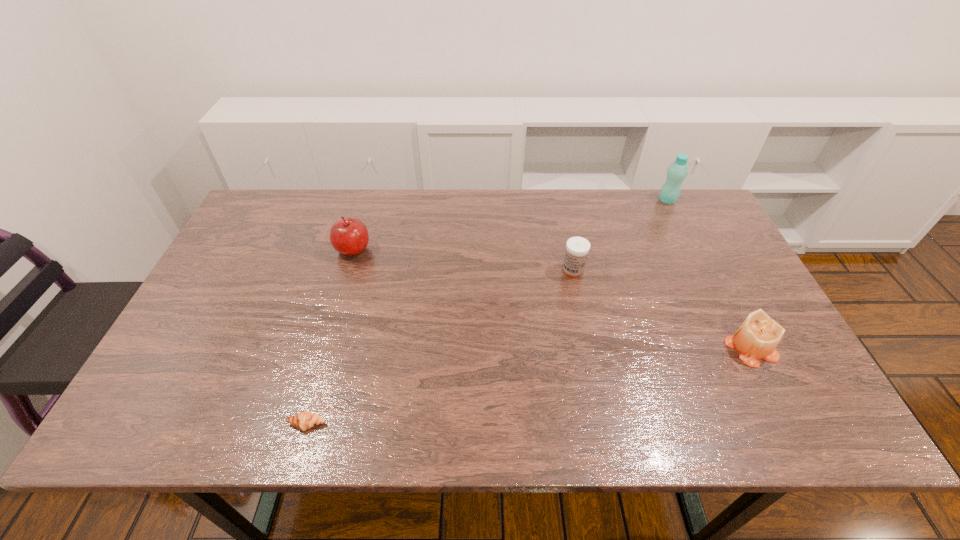
Locate an element on the screen. vacant area at the far left corner is located at coordinates (264, 191).

Find the location of a particular element. The height and width of the screenshot is (540, 960). vacant point at the far right corner is located at coordinates (695, 222).

The image size is (960, 540). Find the location of `free point between the shortest object and the farthest object`. free point between the shortest object and the farthest object is located at coordinates (487, 312).

Identify the location of empty location between the second nearest object and the nearest object. point(529,387).

What are the coordinates of `free spot between the medicine and the apple` in the screenshot? It's located at (463, 260).

Locate an element on the screen. empty location between the third object from right to left and the apple is located at coordinates (463, 260).

The height and width of the screenshot is (540, 960). Find the location of `vacant space that is in between the tallest object and the shortest object`. vacant space that is in between the tallest object and the shortest object is located at coordinates (487, 312).

Find the location of a particular element. unoccupied position between the shortest object and the candle is located at coordinates [x=529, y=387].

At what (x,y) coordinates should I click in order to perform the action: click on empty location between the second nearest object and the pastry. Please return your answer as a coordinate pair (x, y). The width and height of the screenshot is (960, 540). Looking at the image, I should click on (529, 387).

This screenshot has height=540, width=960. What are the coordinates of `unoccupied position between the shortest object and the candle` in the screenshot? It's located at (529, 387).